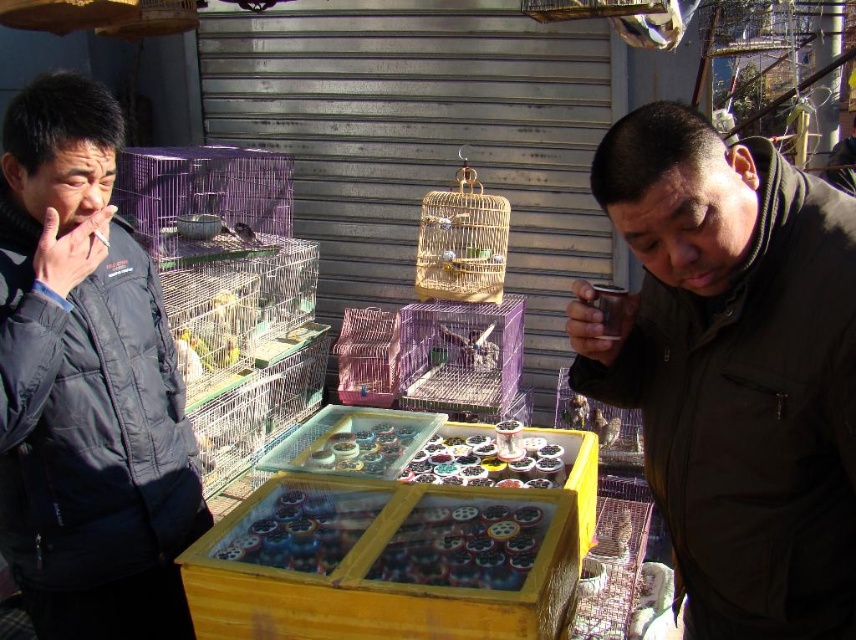
Which is above, dark brown jacket at center or dark gray puffy jacket at left?

dark gray puffy jacket at left

Does dark brown jacket at center have a greater height compared to dark gray puffy jacket at left?

No.

Who is more distant from viewer, (733, 508) or (46, 600)?

The point (46, 600) is behind.

Where is `dark brown jacket at center`? dark brown jacket at center is located at coordinates (733, 369).

Is point (752, 422) closer to camera compared to point (247, 241)?

That is True.

Is dark brown jacket at center closer to the viewer compared to matte brown birdcage at center?

That is True.

The image size is (856, 640). What are the coordinates of `dark brown jacket at center` in the screenshot? It's located at (733, 369).

Which is below, dark gray puffy jacket at left or matte brown birdcage at center?

Positioned lower is dark gray puffy jacket at left.

Does dark gray puffy jacket at left appear on the left side of matte brown birdcage at center?

No, dark gray puffy jacket at left is not to the left of matte brown birdcage at center.

Is point (70, 225) positioned in front of point (245, 225)?

Yes, point (70, 225) is closer to viewer.

This screenshot has height=640, width=856. In order to click on dark gray puffy jacket at left in this screenshot , I will do `click(86, 385)`.